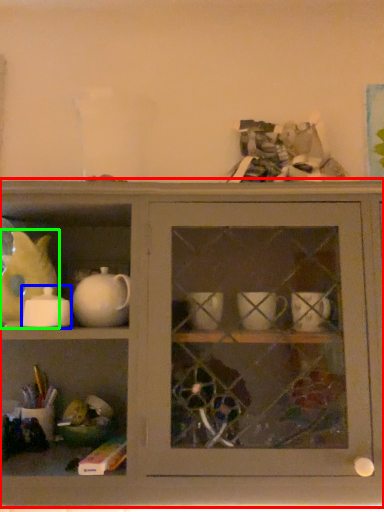
Question: Which object is positioned farthest from shelf (highlighted by a red box)? Select from tableware (highlighted by a blue box) and animal (highlighted by a green box).

Choices:
 (A) tableware
 (B) animal

Answer: (B)